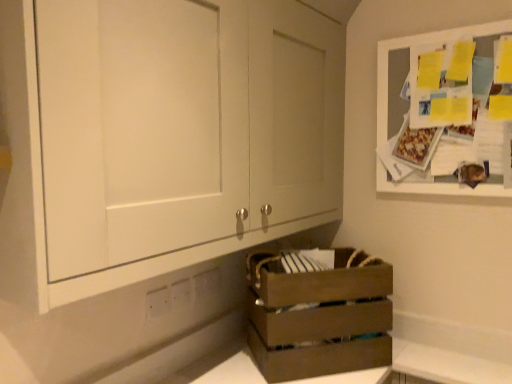
Find the location of `free spot above white wood board at upper right, which is the 1th cabinetry in right-to-left order (from a real-world perspective)`. free spot above white wood board at upper right, which is the 1th cabinetry in right-to-left order (from a real-world perspective) is located at coordinates (444, 28).